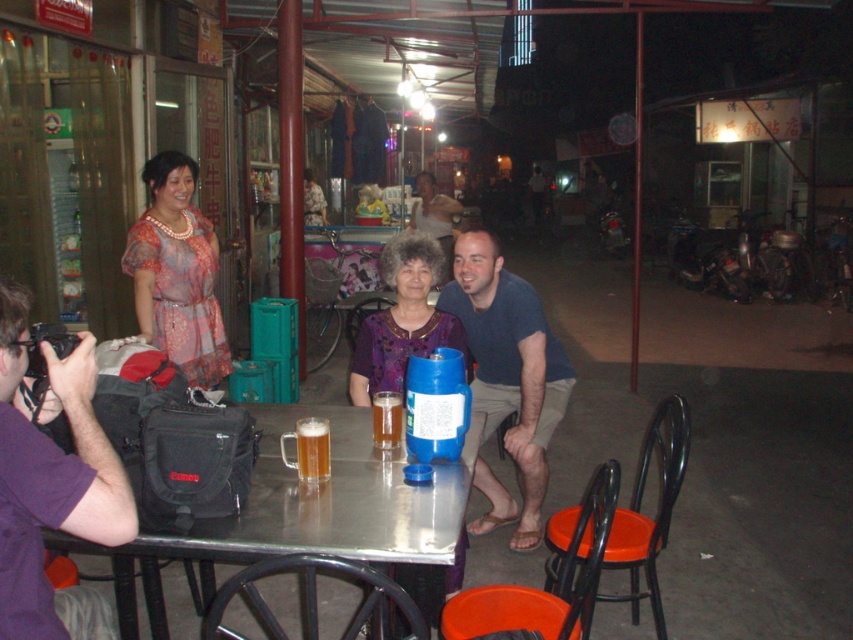
You are setting up a tripod to take a photo of the scene. The tripod needs to be placed exactly halfway between the purple fabric camera at left and the blue plastic container on the table. Where should you position the tripod?

The tripod should be positioned halfway between the purple fabric camera at left and the blue plastic container on the table. Since the purple fabric camera at left is located at point (51, 484), you would need to calculate the midpoint between these coordinates and the coordinates of the blue plastic container to determine the exact placement.

In the scene shown: You are standing at the point marked by the coordinates point (x=293, y=496) and want to reach the entrance of the nearby building located 5 meters away from your current position. If you walk straight ahead, will you be able to reach the entrance without any obstacles?

The distance between you and the entrance is 5 meters, but the point (x=293, y=496) and viewer are 2.20 meters apart from each other. Therefore, you need to walk 2.20 meters forward to reach the entrance, which is within the 5 meters distance. There are no obstacles mentioned, so you can reach the entrance by walking straight ahead.

You are a photographer at the event and need to place a 12 inch wide decorative plate between the purple fabric camera at left and the translucent glass mug at center. Will there be enough space?

The distance between the purple fabric camera at left and the translucent glass mug at center is 25.74 inches. Since the decorative plate is 12 inches wide, there is sufficient space to place it between them as 25.74 inches is greater than 12 inches.